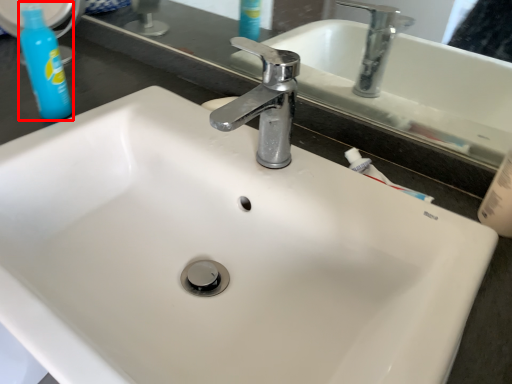
Question: In this image, where is cleaning product (annotated by the red box) located relative to tap?

Choices:
 (A) left
 (B) right

Answer: (A)